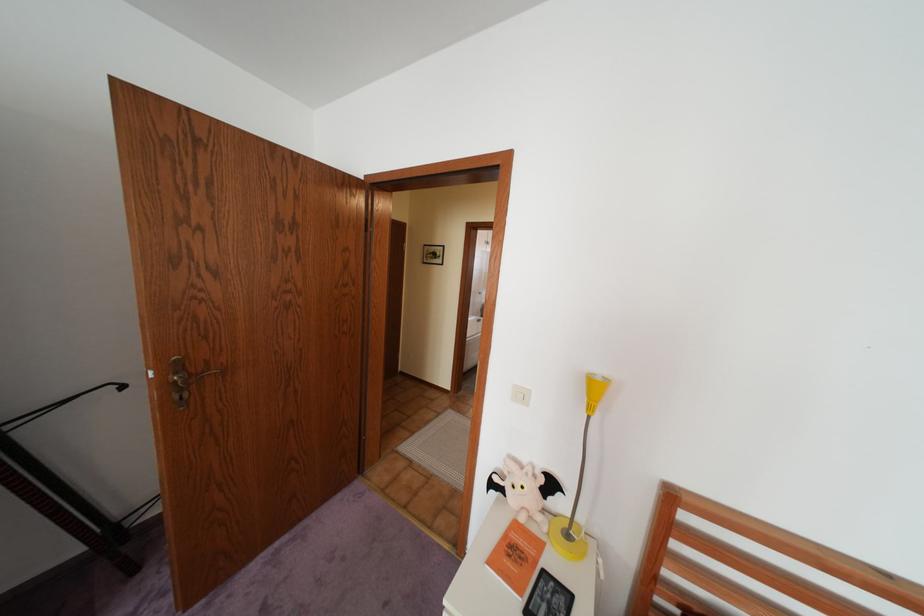
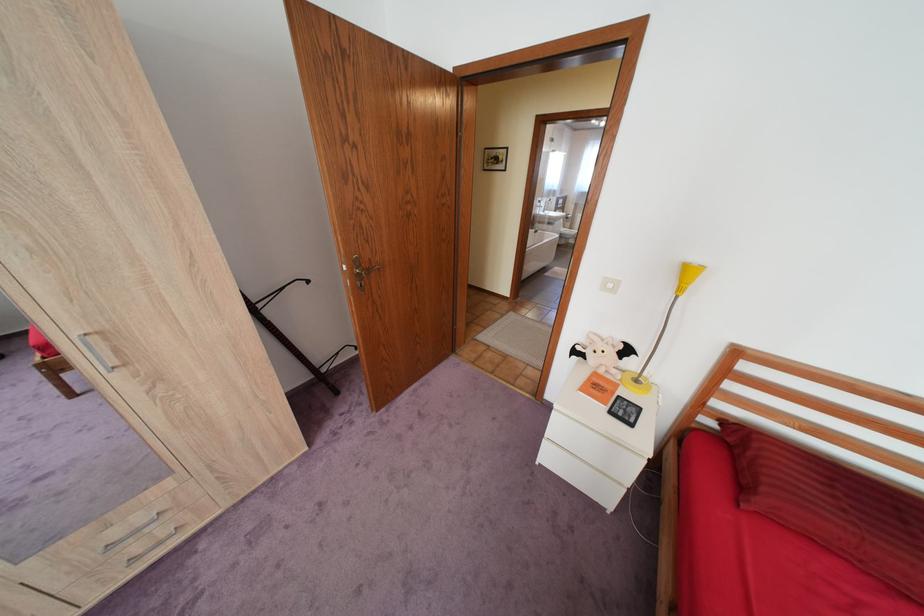
Find the pixel in the second image that matches point (161, 371) in the first image.

(355, 265)